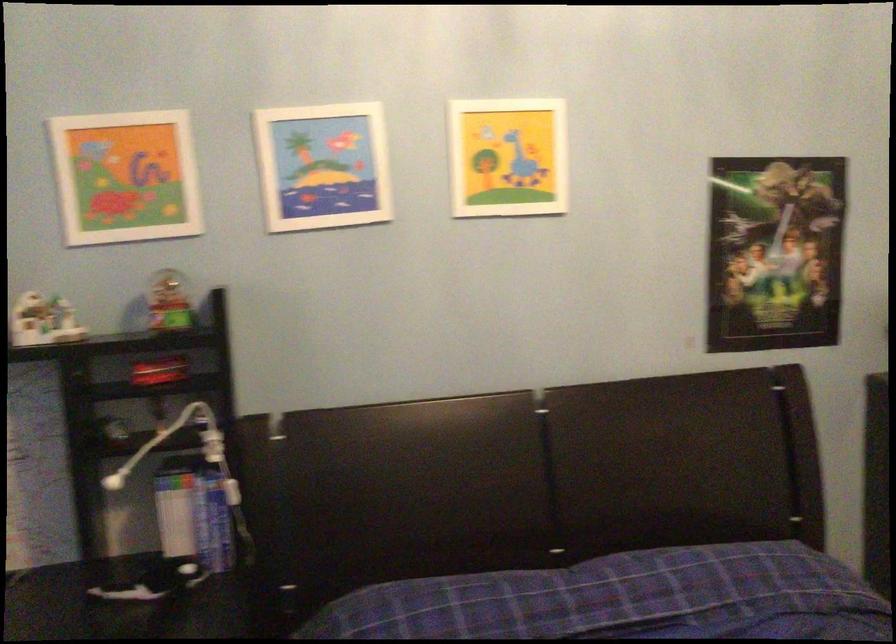
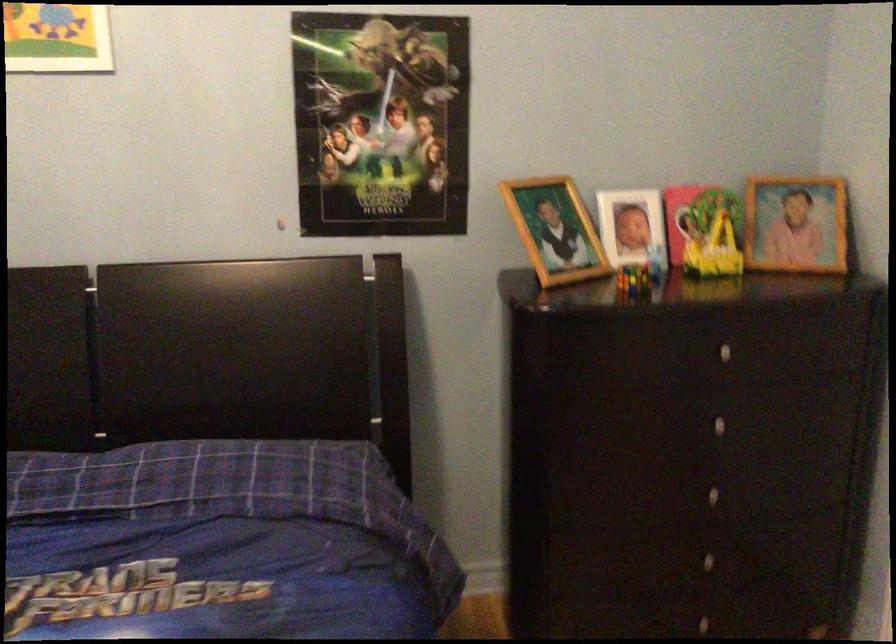
Question: In a continuous first-person perspective shot, in which direction is the camera moving?

Choices:
 (A) Left
 (B) Right
 (C) Forward
 (D) Backward

Answer: (B)